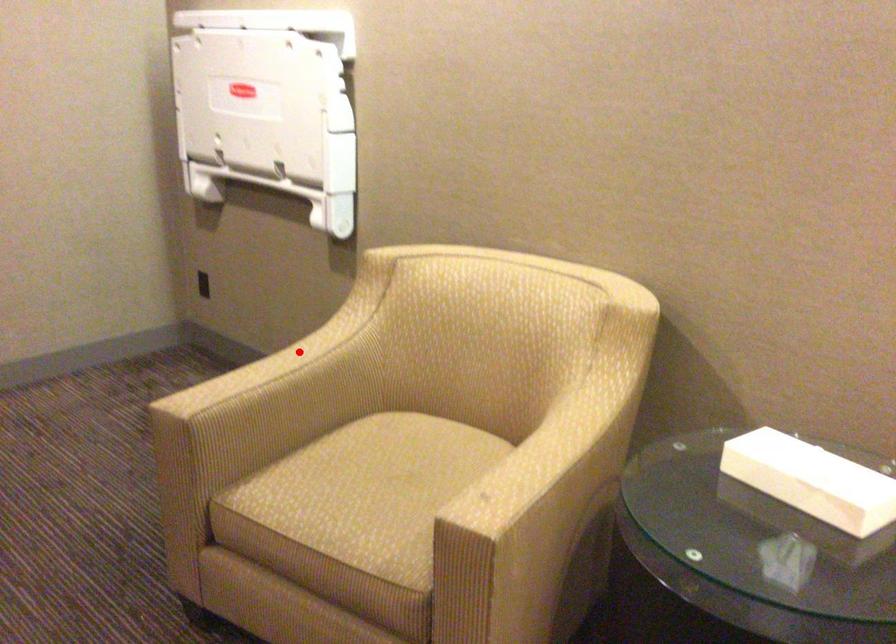
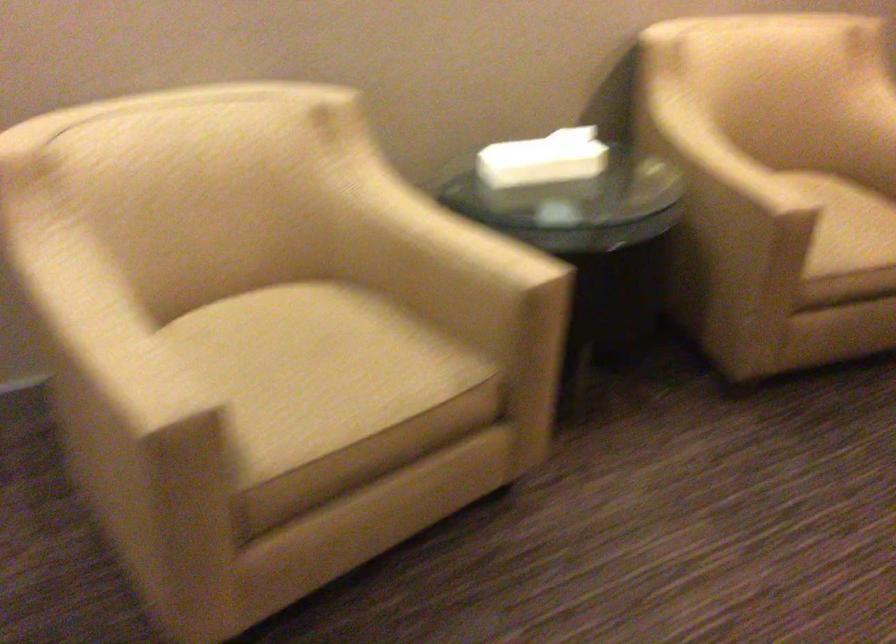
Locate, in the second image, the point that corresponds to the highlighted location in the first image.

(89, 304)